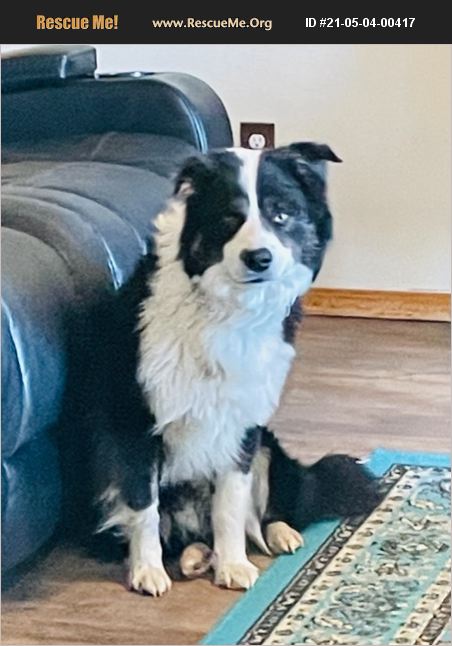
You are a GUI agent. You are given a task and a screenshot of the screen. Output one action in this format:
    pyautogui.click(x=<x>, y=<y>)
    Task: Click on the arm rest
    This screenshot has width=452, height=646.
    Given the screenshot: What is the action you would take?
    pyautogui.click(x=176, y=106)